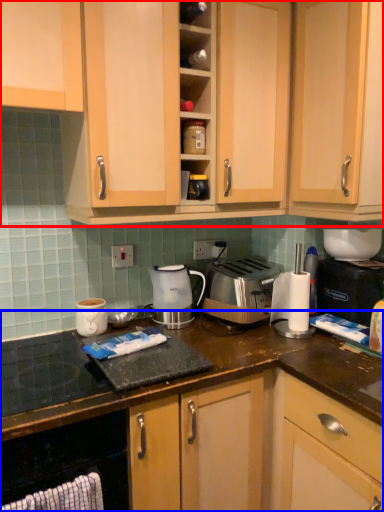
Question: Among these objects, which one is farthest to the camera, cabinetry (highlighted by a red box) or cabinetry (highlighted by a blue box)?

Choices:
 (A) cabinetry
 (B) cabinetry

Answer: (A)